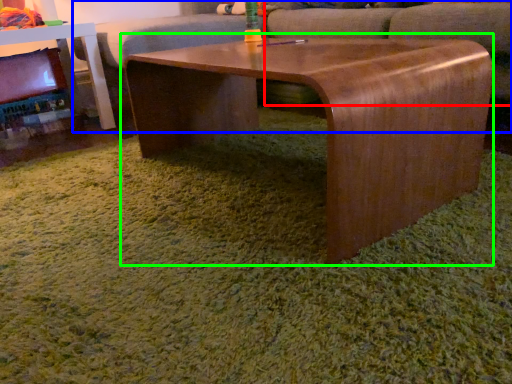
Question: Which is nearer to the swivel chair (highlighted by a red box)? couch (highlighted by a blue box) or coffee table (highlighted by a green box).

Choices:
 (A) couch
 (B) coffee table

Answer: (A)